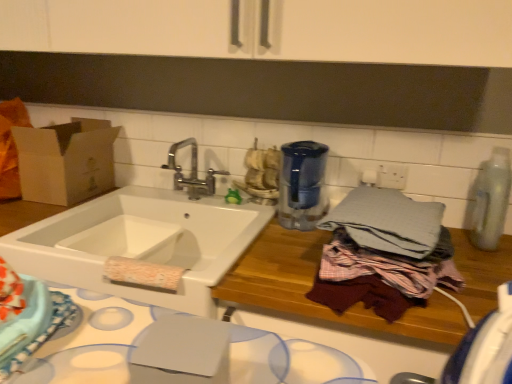
Find the location of `blue glass water filter at center, the 1th appliance when ordered from left to right`. blue glass water filter at center, the 1th appliance when ordered from left to right is located at coordinates (302, 185).

Describe the element at coordinates (302, 185) in the screenshot. I see `blue glass water filter at center, the 1th appliance when ordered from left to right` at that location.

Describe the element at coordinates (66, 161) in the screenshot. I see `brown cardboard box at left` at that location.

Identify the location of brown cardboard box at left. (66, 161).

Measure the distance between textured wooden table at right and camera.

A distance of 31.57 inches exists between textured wooden table at right and camera.

The image size is (512, 384). Identify the location of blue glass water filter at center, the 1th appliance when ordered from left to right. (302, 185).

From the image's perspective, is blue glass water filter at center, acting as the second appliance starting from the right, positioned above or below chrome metallic faucet at upper center?

From the image's perspective, blue glass water filter at center, acting as the second appliance starting from the right, appears below chrome metallic faucet at upper center.

Considering the relative sizes of blue glass water filter at center, the 1th appliance when ordered from left to right, and chrome metallic faucet at upper center in the image provided, is blue glass water filter at center, the 1th appliance when ordered from left to right, taller than chrome metallic faucet at upper center?

Yes, blue glass water filter at center, the 1th appliance when ordered from left to right, is taller than chrome metallic faucet at upper center.

Is blue glass water filter at center, the 1th appliance when ordered from left to right, next to chrome metallic faucet at upper center?

They are not placed beside each other.

Which is farther, (x=176, y=150) or (x=8, y=284)?

The point (x=176, y=150) is more distant.

I want to click on tap located above the blue fabric cloth at lower left (from the image's perspective), so click(x=191, y=172).

From the picture: Does chrome metallic faucet at upper center have a greater height compared to blue fabric cloth at lower left?

Indeed, chrome metallic faucet at upper center has a greater height compared to blue fabric cloth at lower left.

From the picture: Considering the positions of objects chrome metallic faucet at upper center and blue fabric cloth at lower left in the image provided, who is more to the left, chrome metallic faucet at upper center or blue fabric cloth at lower left?

From the viewer's perspective, blue fabric cloth at lower left appears more on the left side.

Is blue fabric cloth at lower left taller than wooden cutting board at center?

Incorrect, the height of blue fabric cloth at lower left is not larger of that of wooden cutting board at center.

Locate an element on the screen. The width and height of the screenshot is (512, 384). counter on the right of blue fabric cloth at lower left is located at coordinates (357, 347).

Is blue fabric cloth at lower left turned away from wooden cutting board at center?

blue fabric cloth at lower left is not turned away from wooden cutting board at center.

Based on the photo, which is more to the right, blue fabric cloth at lower left or wooden cutting board at center?

Positioned to the right is wooden cutting board at center.

Considering the sizes of objects white ceramic sink at center and clear plastic bottle at right, marked as the 2th appliance in a left-to-right arrangement, in the image provided, who is smaller, white ceramic sink at center or clear plastic bottle at right, marked as the 2th appliance in a left-to-right arrangement,?

With smaller size is clear plastic bottle at right, marked as the 2th appliance in a left-to-right arrangement.

Can you confirm if white ceramic sink at center is wider than clear plastic bottle at right, the 1th appliance viewed from the right?

Yes, white ceramic sink at center is wider than clear plastic bottle at right, the 1th appliance viewed from the right.

Based on the photo, is white ceramic sink at center inside or outside of clear plastic bottle at right, marked as the 2th appliance in a left-to-right arrangement?

white ceramic sink at center lies outside clear plastic bottle at right, marked as the 2th appliance in a left-to-right arrangement.

Would you say textured wooden table at right is a long distance from blue glass water filter at center, the 1th appliance when ordered from left to right?

No, textured wooden table at right is in close proximity to blue glass water filter at center, the 1th appliance when ordered from left to right.

Which object is closer to the camera taking this photo, textured wooden table at right or blue glass water filter at center, acting as the second appliance starting from the right?

textured wooden table at right is in front.

Between textured wooden table at right and blue glass water filter at center, the 1th appliance when ordered from left to right, which one appears on the left side from the viewer's perspective?

Positioned to the left is blue glass water filter at center, the 1th appliance when ordered from left to right.

From a real-world perspective, is textured wooden table at right physically above blue glass water filter at center, acting as the second appliance starting from the right?

No, from a real-world perspective, textured wooden table at right is not on top of blue glass water filter at center, acting as the second appliance starting from the right.

Is blue glass water filter at center, the 1th appliance when ordered from left to right, looking in the opposite direction of textured wooden table at right?

No, textured wooden table at right is not at the back of blue glass water filter at center, the 1th appliance when ordered from left to right.

Can you confirm if blue glass water filter at center, the 1th appliance when ordered from left to right, is thinner than textured wooden table at right?

Indeed, blue glass water filter at center, the 1th appliance when ordered from left to right, has a lesser width compared to textured wooden table at right.

Who is shorter, blue glass water filter at center, acting as the second appliance starting from the right, or textured wooden table at right?

textured wooden table at right is shorter.

Which is in front, blue glass water filter at center, the 1th appliance when ordered from left to right, or textured wooden table at right?

textured wooden table at right is more forward.

How much distance is there between wooden cutting board at center and chrome metallic faucet at upper center?

They are 79.51 centimeters apart.

From the image's perspective, would you say wooden cutting board at center is shown under chrome metallic faucet at upper center?

Yes, from the image's perspective, wooden cutting board at center is below chrome metallic faucet at upper center.

Based on their sizes in the image, would you say wooden cutting board at center is bigger or smaller than chrome metallic faucet at upper center?

Clearly, wooden cutting board at center is larger in size than chrome metallic faucet at upper center.

Considering the sizes of objects wooden cutting board at center and chrome metallic faucet at upper center in the image provided, who is thinner, wooden cutting board at center or chrome metallic faucet at upper center?

chrome metallic faucet at upper center.

What are the coordinates of `tap behind the blue glass water filter at center, the 1th appliance when ordered from left to right` in the screenshot? It's located at (191, 172).

At what (x,y) coordinates should I click in order to perform the action: click on tap that appears above the blue fabric cloth at lower left (from a real-world perspective). Please return your answer as a coordinate pair (x, y). This screenshot has width=512, height=384. Looking at the image, I should click on [x=191, y=172].

Estimate the real-world distances between objects in this image. Which object is further from chrome metallic faucet at upper center, textured wooden table at right or blue fabric cloth at lower left?

blue fabric cloth at lower left is positioned further to the anchor chrome metallic faucet at upper center.

Considering their positions, is textured wooden table at right positioned further to gray cotton bath towel at right than clear plastic bottle at right, the 1th appliance viewed from the right?

clear plastic bottle at right, the 1th appliance viewed from the right, is further to gray cotton bath towel at right.

Which object lies nearer to the anchor point chrome metallic faucet at upper center, clear plastic bottle at right, the 1th appliance viewed from the right, or blue glass water filter at center, acting as the second appliance starting from the right?

blue glass water filter at center, acting as the second appliance starting from the right, is closer to chrome metallic faucet at upper center.

Looking at the image, which one is located closer to brown cardboard box at left, blue fabric cloth at lower left or blue glass water filter at center, acting as the second appliance starting from the right?

blue glass water filter at center, acting as the second appliance starting from the right, is positioned closer to the anchor brown cardboard box at left.

From the image, which object appears to be nearer to white ceramic sink at center, blue fabric cloth at lower left or brown cardboard box at left?

brown cardboard box at left lies closer to white ceramic sink at center than the other object.

Which object lies nearer to the anchor point clear plastic bottle at right, marked as the 2th appliance in a left-to-right arrangement, gray cotton bath towel at right or chrome metallic faucet at upper center?

gray cotton bath towel at right.

Estimate the real-world distances between objects in this image. Which object is further from blue fabric cloth at lower left, brown cardboard box at left or clear plastic bottle at right, the 1th appliance viewed from the right?

clear plastic bottle at right, the 1th appliance viewed from the right, is positioned further to the anchor blue fabric cloth at lower left.

Which object lies nearer to the anchor point gray cotton bath towel at right, clear plastic bottle at right, marked as the 2th appliance in a left-to-right arrangement, or textured wooden table at right?

Based on the image, textured wooden table at right appears to be nearer to gray cotton bath towel at right.

The width and height of the screenshot is (512, 384). Find the location of `appliance situated between white ceramic sink at center and clear plastic bottle at right, marked as the 2th appliance in a left-to-right arrangement, from left to right`. appliance situated between white ceramic sink at center and clear plastic bottle at right, marked as the 2th appliance in a left-to-right arrangement, from left to right is located at coordinates (302, 185).

Where is `sink between chrome metallic faucet at upper center and wooden cutting board at center from top to bottom`? sink between chrome metallic faucet at upper center and wooden cutting board at center from top to bottom is located at coordinates (140, 244).

Identify the location of counter situated between blue fabric cloth at lower left and textured wooden table at right from left to right. coord(357,347).

At what (x,y) coordinates should I click in order to perform the action: click on tap located between brown cardboard box at left and clear plastic bottle at right, marked as the 2th appliance in a left-to-right arrangement, in the left-right direction. Please return your answer as a coordinate pair (x, y). The width and height of the screenshot is (512, 384). Looking at the image, I should click on (191, 172).